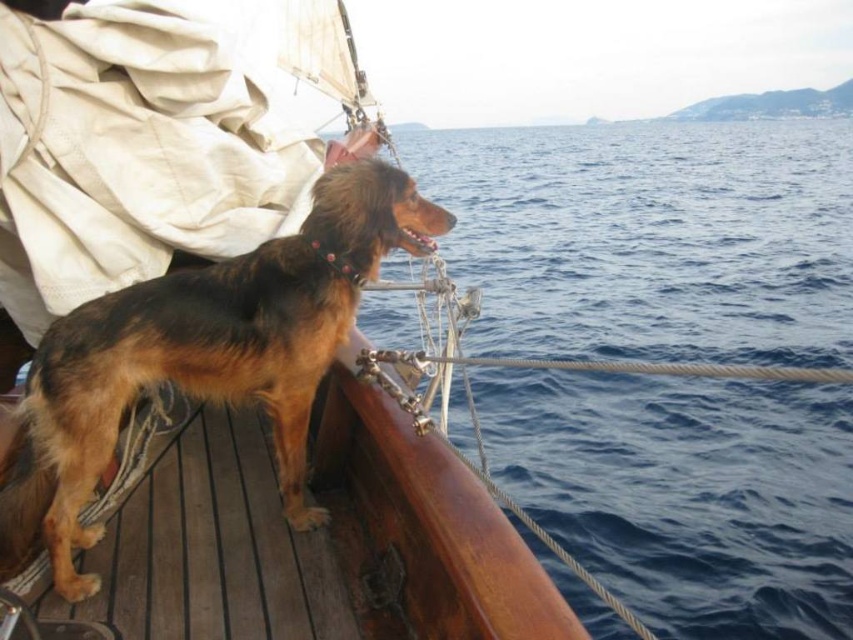
You are standing on the deck of the boat and want to take a photo of the point at coordinate (846, 364). If your camera can focus on objects up to 10 meters away, will it be able to capture the point clearly?

The point at coordinate (846, 364) is exactly 10.00 meters away from the camera. Since the camera can focus up to 10 meters, it should be able to capture the point clearly.

You are navigating a boat and need to determine the position of the blue water relative to the boat. According to the coordinates provided, where exactly is the blue water at center located?

The blue water at center is located at point coordinates of 0.373 on the x axis and 0.763 on the y axis.

You are a sailor on the deck of the boat. You want to walk from the metallic railing to the brown furry dog at left. Is the blue water at center in your path?

The blue water at center is positioned over the brown furry dog at left, so it is not in your path as you walk from the metallic railing to the brown furry dog at left.